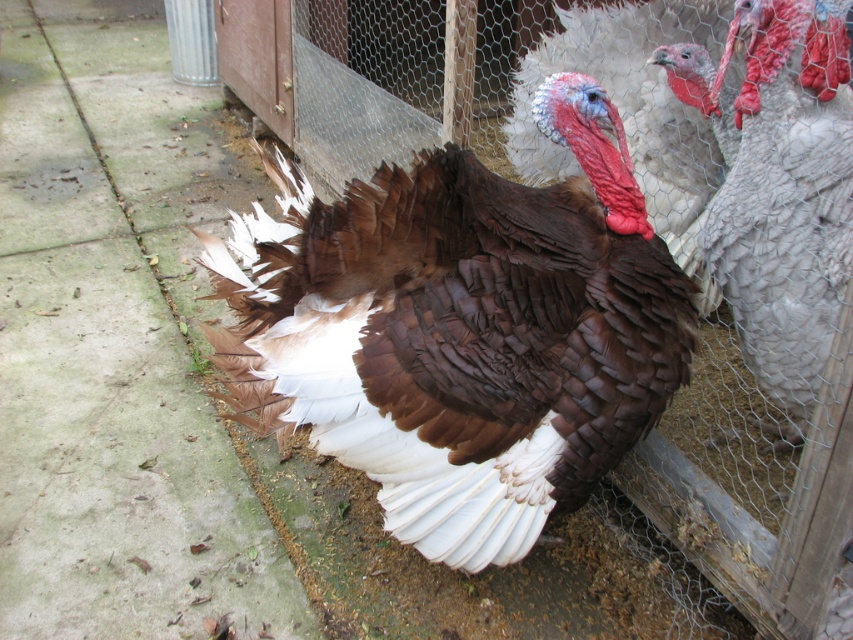
Which is more to the left, brown glossy turkey at center or white feathered turkey at right?

brown glossy turkey at center

Between brown glossy turkey at center and white feathered turkey at right, which one is positioned higher?

white feathered turkey at right

Is point (276, 298) less distant than point (756, 276)?

Yes.

The width and height of the screenshot is (853, 640). Identify the location of brown glossy turkey at center. (460, 330).